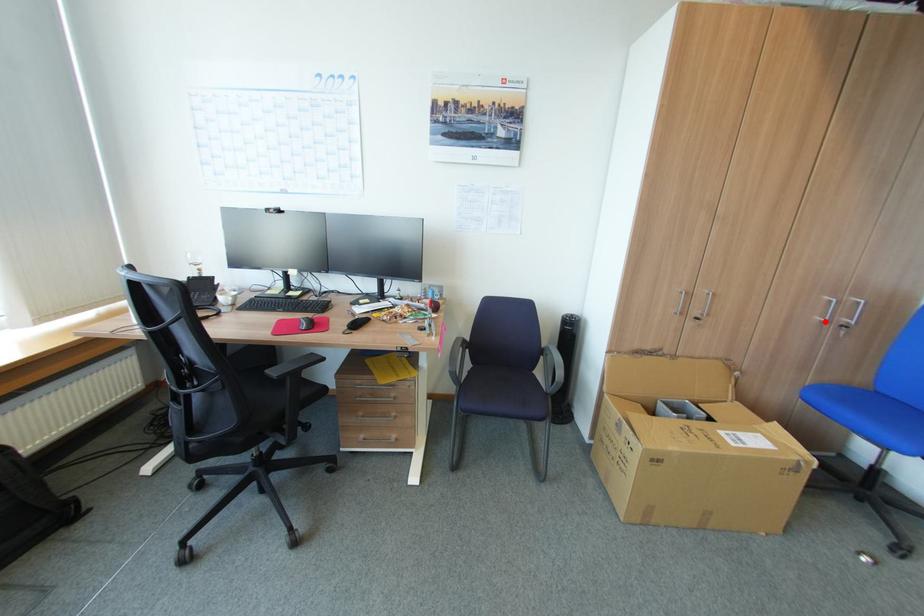
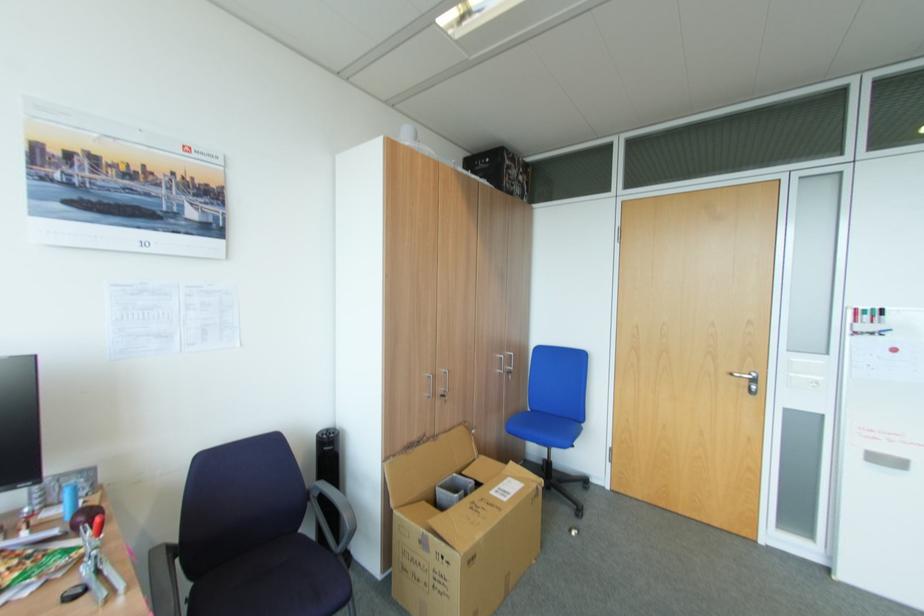
Question: I am providing you with two images of the same scene from different viewpoints. In image1, a red point is highlighted. Considering the same 3D point in image2, which of the following is correct?

Choices:
 (A) It is closer
 (B) It is farther

Answer: (B)